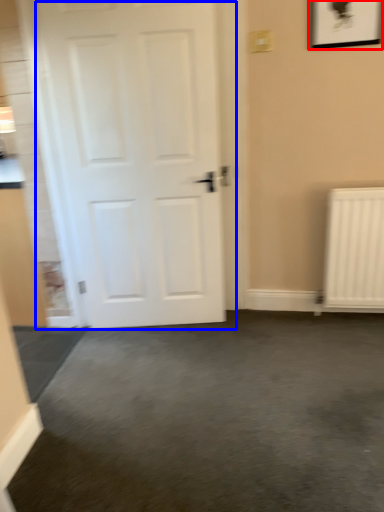
Question: Which object is closer to the camera taking this photo, picture frame (highlighted by a red box) or door (highlighted by a blue box)?

Choices:
 (A) picture frame
 (B) door

Answer: (B)